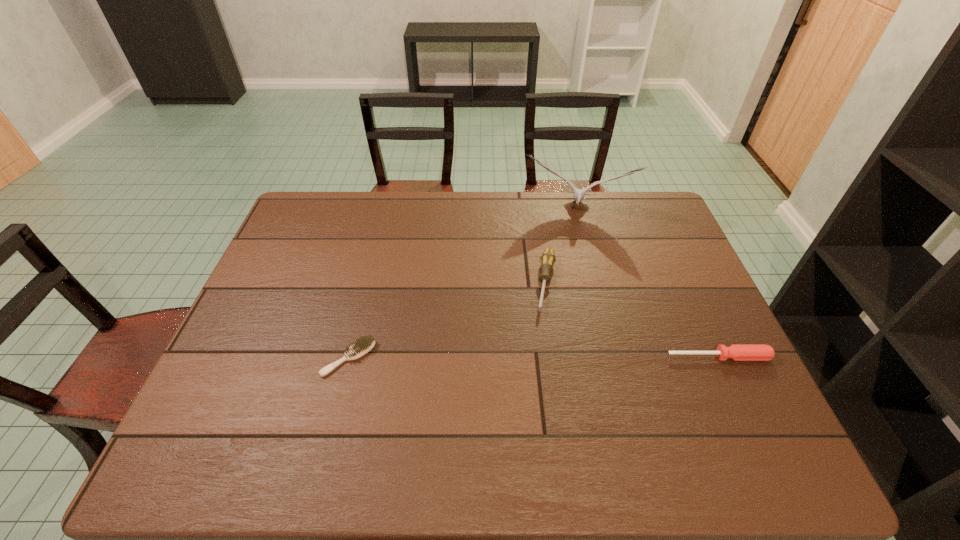
At what (x,y) coordinates should I click in order to perform the action: click on the shortest object. Please return your answer as a coordinate pair (x, y). This screenshot has width=960, height=540. Looking at the image, I should click on (363, 345).

This screenshot has height=540, width=960. I want to click on scrubbing brush, so click(x=363, y=345).

Locate an element on the screen. The image size is (960, 540). the shorter screwdriver is located at coordinates (737, 352).

Identify the location of the right screwdriver. Image resolution: width=960 pixels, height=540 pixels. (737, 352).

At what (x,y) coordinates should I click in order to perform the action: click on the tallest object. Please return your answer as a coordinate pair (x, y). This screenshot has height=540, width=960. Looking at the image, I should click on tap(579, 194).

Locate an element on the screen. gull is located at coordinates (579, 194).

You are a GUI agent. You are given a task and a screenshot of the screen. Output one action in this format:
    pyautogui.click(x=<x>, y=<y>)
    Task: Click on the left screwdriver
    This screenshot has width=960, height=540.
    Given the screenshot: What is the action you would take?
    pyautogui.click(x=548, y=259)

Locate an element on the screen. The image size is (960, 540). the second farthest object is located at coordinates (548, 259).

Locate an element on the screen. This screenshot has width=960, height=540. vacant space located on the left of the scrubbing brush is located at coordinates (238, 358).

Where is `free space located at the tip of the right screwdriver`? This screenshot has width=960, height=540. free space located at the tip of the right screwdriver is located at coordinates coord(743,410).